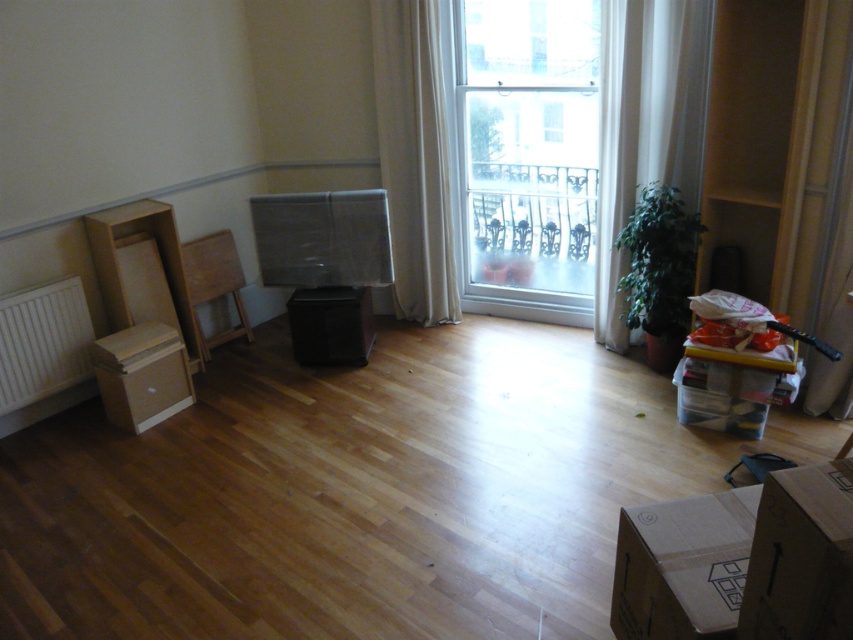
You are moving into a new apartment and need to place a 2.5 meter long sofa between the green fabric curtain at right and the white matte radiator at lower left. Is there enough space for the sofa?

The distance between the green fabric curtain at right and the white matte radiator at lower left is 3.34 meters, so yes, the sofa can be placed there since it is shorter than the available space.

You are trying to decide whether to place a large piece of furniture in the room. The furniture requires a space that is at least as big as the green fabric curtain at right. Based on the scene, is there enough space near the white matte radiator at lower left to accommodate this furniture?

The green fabric curtain at right is larger in size than the white matte radiator at lower left. Since the furniture needs space at least as big as the curtain, the area near the radiator is smaller and may not be sufficient.

You are moving into a new apartment and need to access the cardboard box at lower right. However, there is a green fabric curtain at right in the way. Can you reach the box without moving the curtain?

The cardboard box at lower right is behind the green fabric curtain at right, so you can reach it without moving the curtain because it is positioned behind it.